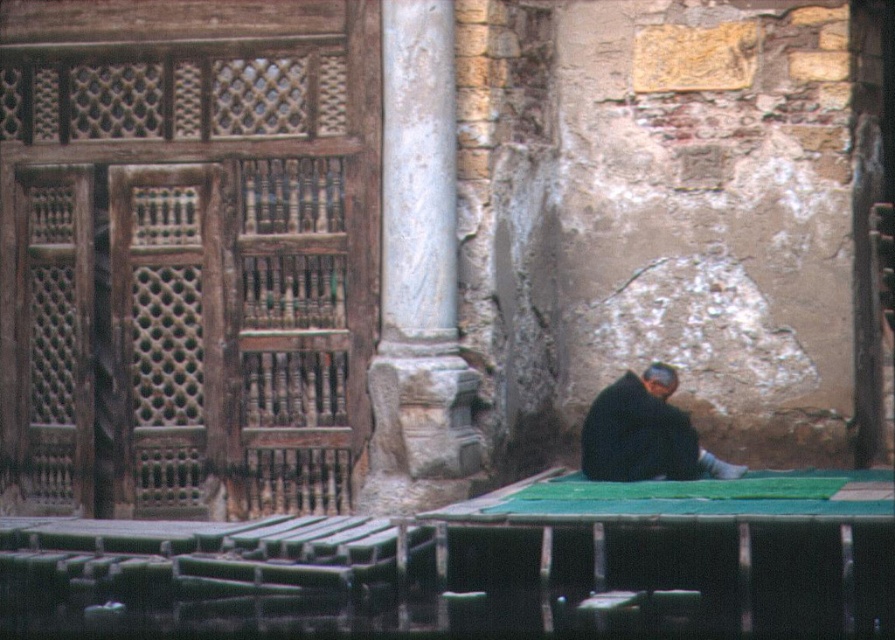
You are standing in front of the wooden door with intricate lattice patterns and see the white marble column at center and the black matte jacket at lower right. Which object is closer to your right side?

The black matte jacket at lower right is closer to your right side because it is positioned to the right of the white marble column at center.

You are a photographer standing in front of the aged stone wall. You want to take a photo of the white marble column at center and the black matte jacket at lower right. Which object should you focus on first to ensure both are in sharp focus?

You should focus on the white marble column at center first because it is closer to you than the black matte jacket at lower right, so focusing on it will help keep both objects in focus.

You are a delivery person who needs to place a package between the white marble column at center and the black matte jacket at lower right. The package requires a space of 6 feet. Can you fit it there?

The distance between the white marble column at center and the black matte jacket at lower right is 6.72 feet, which is more than enough to accommodate the 6 feet required for the package. Yes, you can fit the package there.